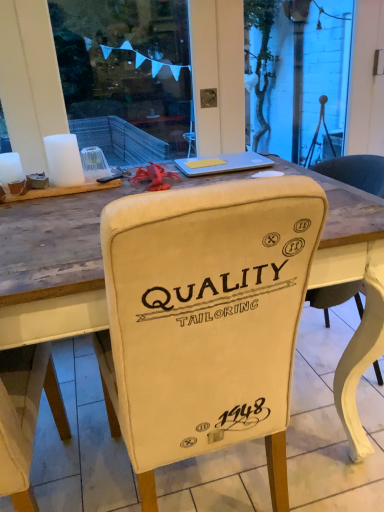
Question: Can you confirm if beige fabric chair at center is wider than silver metallic laptop at upper center?

Choices:
 (A) yes
 (B) no

Answer: (A)

Question: Can you confirm if beige fabric chair at center is shorter than silver metallic laptop at upper center?

Choices:
 (A) yes
 (B) no

Answer: (B)

Question: Considering the relative sizes of beige fabric chair at center and silver metallic laptop at upper center in the image provided, is beige fabric chair at center taller than silver metallic laptop at upper center?

Choices:
 (A) no
 (B) yes

Answer: (B)

Question: Is beige fabric chair at center positioned with its back to silver metallic laptop at upper center?

Choices:
 (A) no
 (B) yes

Answer: (A)

Question: Is beige fabric chair at center located outside silver metallic laptop at upper center?

Choices:
 (A) no
 (B) yes

Answer: (B)

Question: From the image's perspective, is beige fabric chair at center located beneath silver metallic laptop at upper center?

Choices:
 (A) yes
 (B) no

Answer: (A)

Question: Considering the relative positions of silver metallic laptop at upper center and beige fabric chair at center in the image provided, is silver metallic laptop at upper center in front of beige fabric chair at center?

Choices:
 (A) yes
 (B) no

Answer: (B)

Question: Is silver metallic laptop at upper center oriented away from beige fabric chair at center?

Choices:
 (A) no
 (B) yes

Answer: (A)

Question: Is silver metallic laptop at upper center beside beige fabric chair at center?

Choices:
 (A) yes
 (B) no

Answer: (B)

Question: Can you confirm if silver metallic laptop at upper center is shorter than beige fabric chair at center?

Choices:
 (A) no
 (B) yes

Answer: (B)

Question: Is silver metallic laptop at upper center oriented towards beige fabric chair at center?

Choices:
 (A) no
 (B) yes

Answer: (A)

Question: Is the position of silver metallic laptop at upper center more distant than that of beige fabric chair at center?

Choices:
 (A) yes
 (B) no

Answer: (A)

Question: Is beige fabric chair at center taller or shorter than silver metallic laptop at upper center?

Choices:
 (A) short
 (B) tall

Answer: (B)